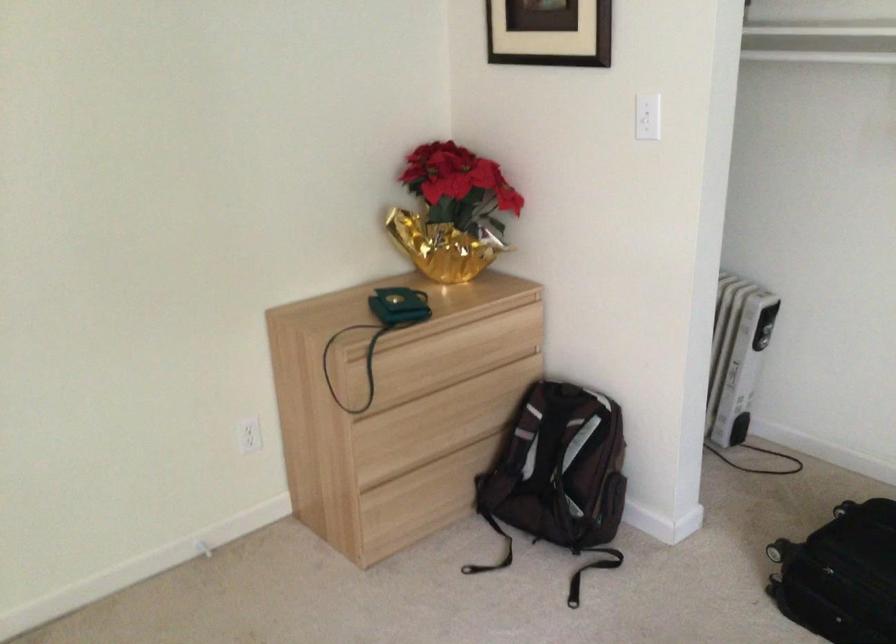
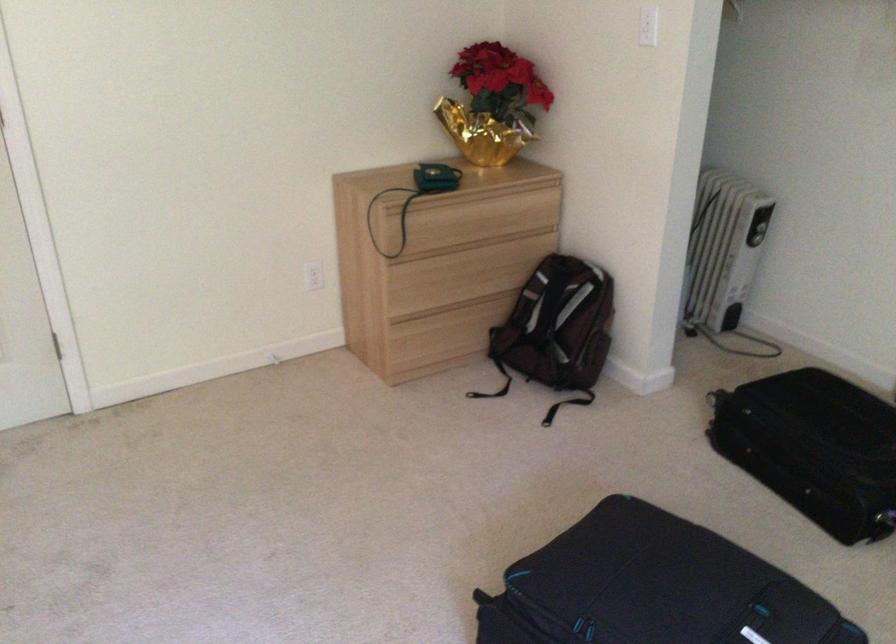
Locate, in the second image, the point that corresponds to point 421,507 in the first image.

(442, 345)